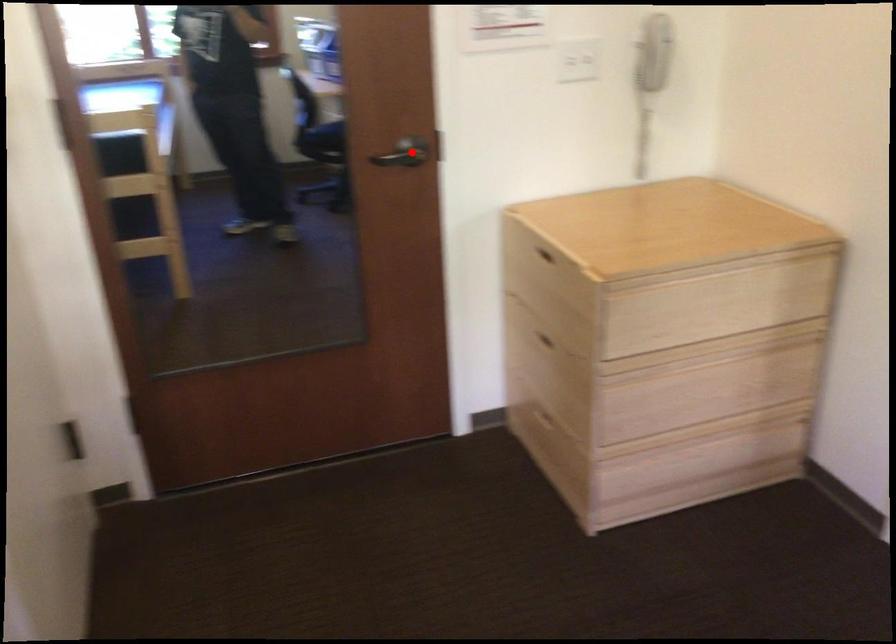
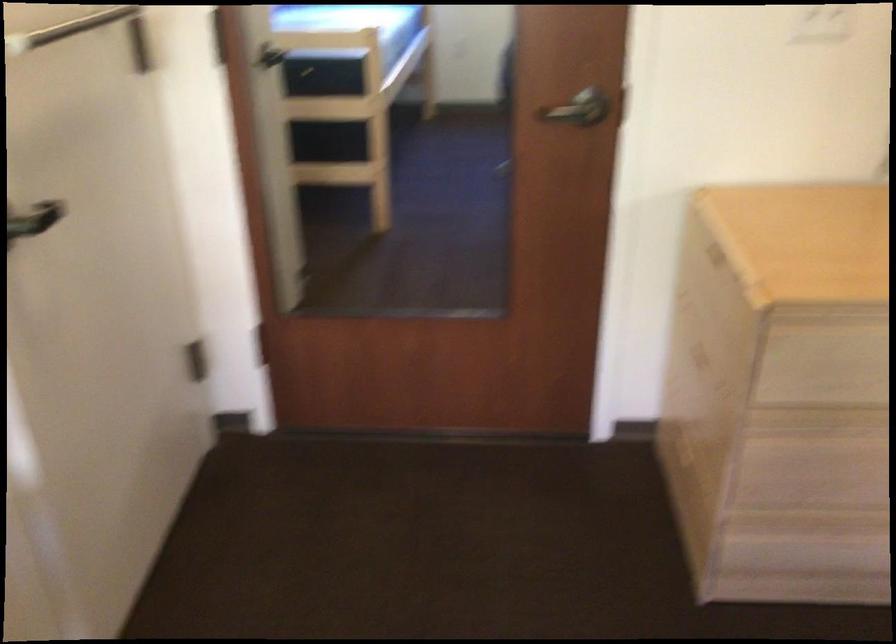
The point at the highlighted location is marked in the first image. Where is the corresponding point in the second image?

(583, 111)